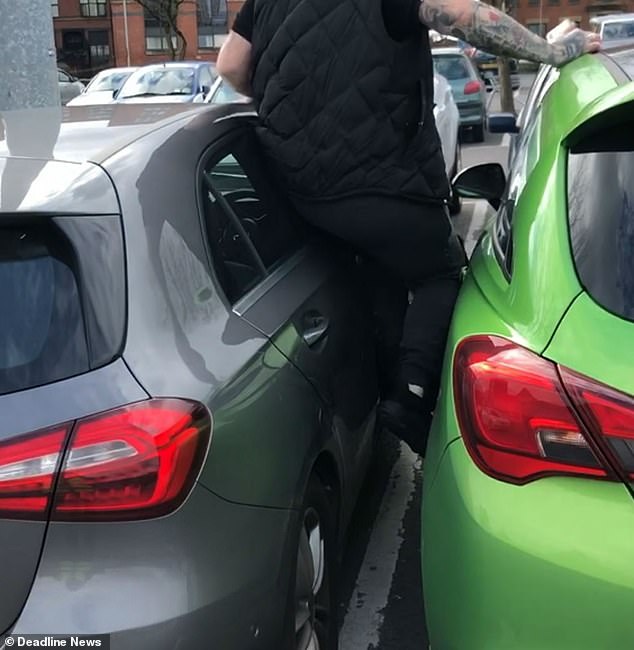
Locate an element on the screen. Image resolution: width=634 pixels, height=650 pixels. sock is located at coordinates (416, 393).